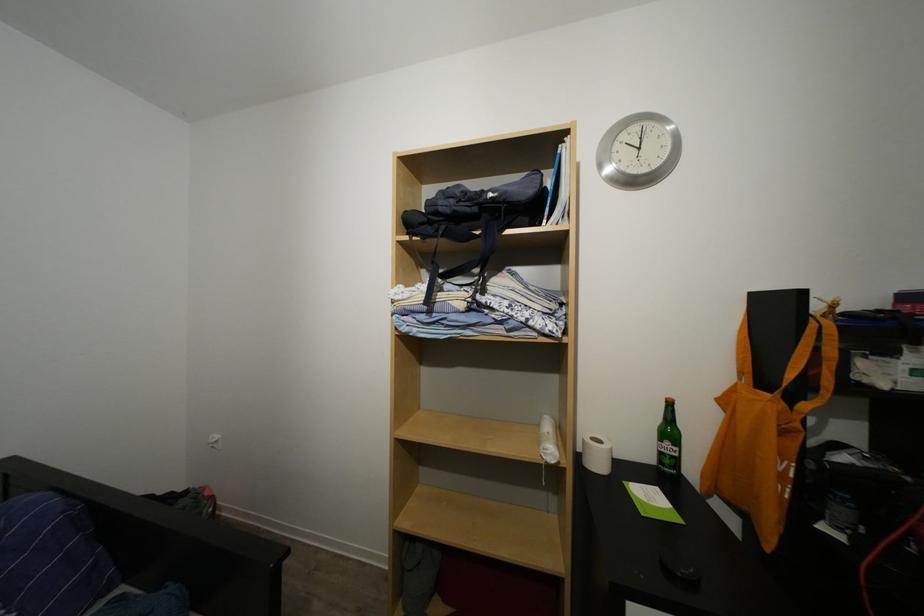
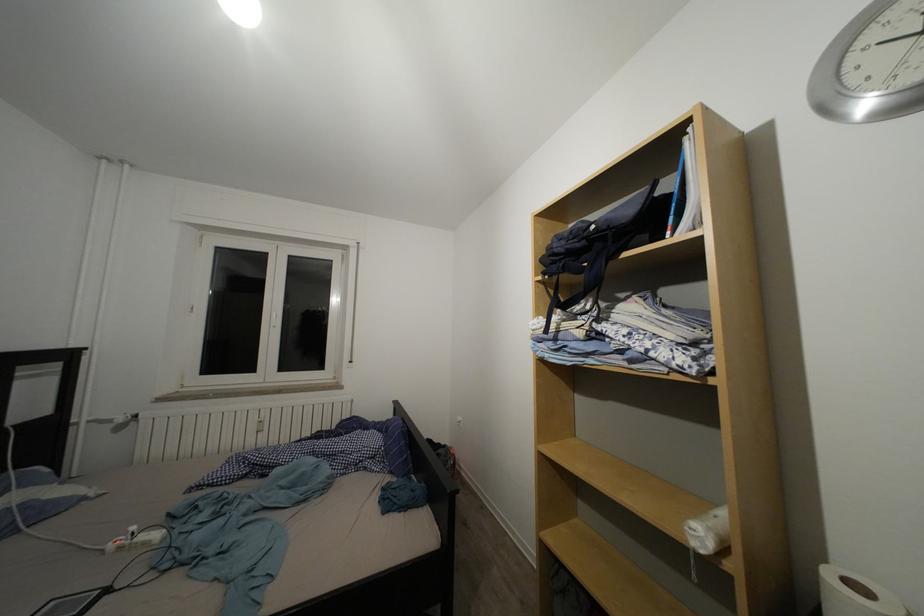
Question: The camera is either moving clockwise (left) or counter-clockwise (right) around the object. The first image is from the beginning of the video and the second image is from the end. Is the camera moving left or right when shooting the video?

Choices:
 (A) Left
 (B) Right

Answer: (B)